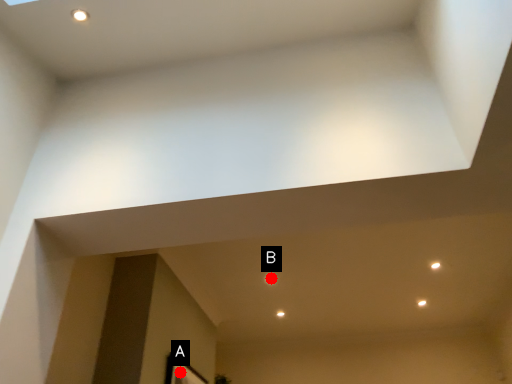
Question: Two points are circled on the image, labeled by A and B beside each circle. Among these points, which one is nearest to the camera?

Choices:
 (A) A is closer
 (B) B is closer

Answer: (A)